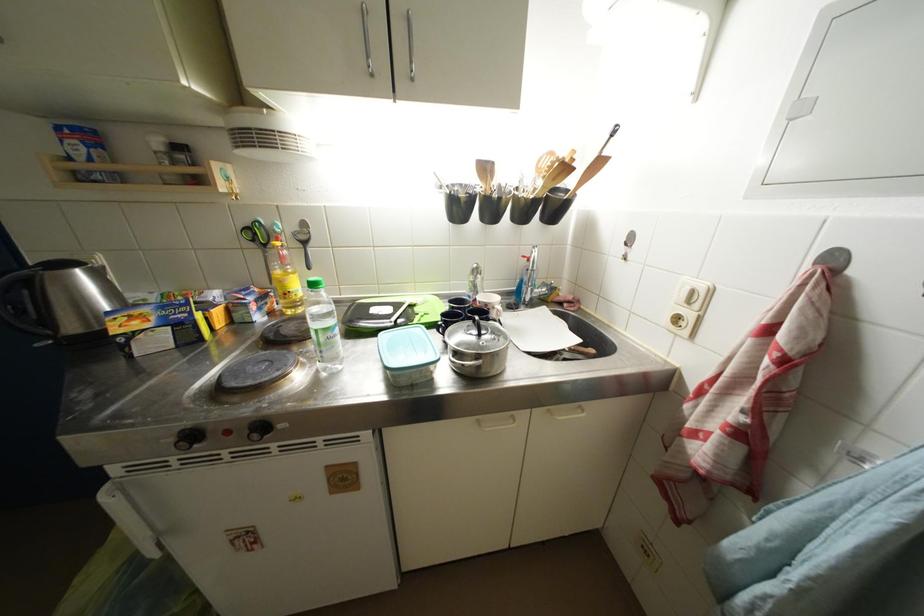
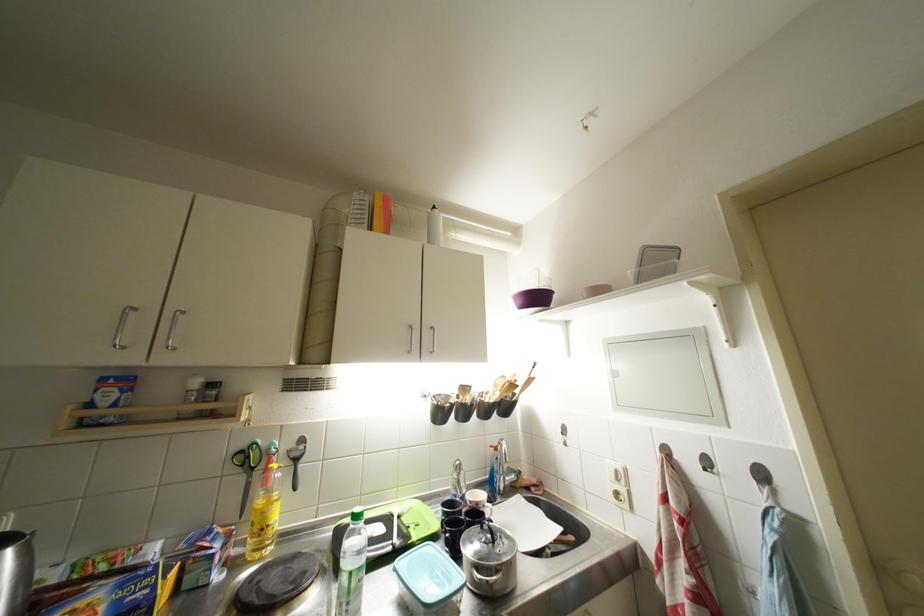
Locate, in the second image, the point that corresponds to the point at 572,172 in the first image.

(519, 390)